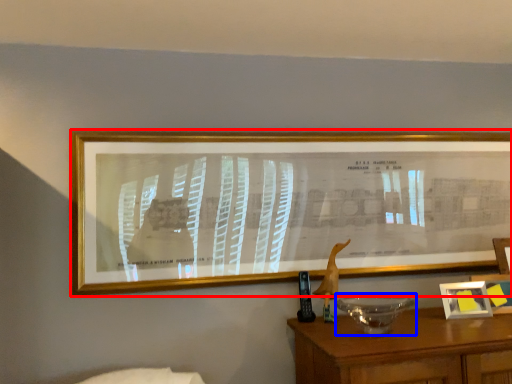
Question: Which object appears farthest to the camera in this image, picture frame (highlighted by a red box) or glass bowl (highlighted by a blue box)?

Choices:
 (A) picture frame
 (B) glass bowl

Answer: (A)